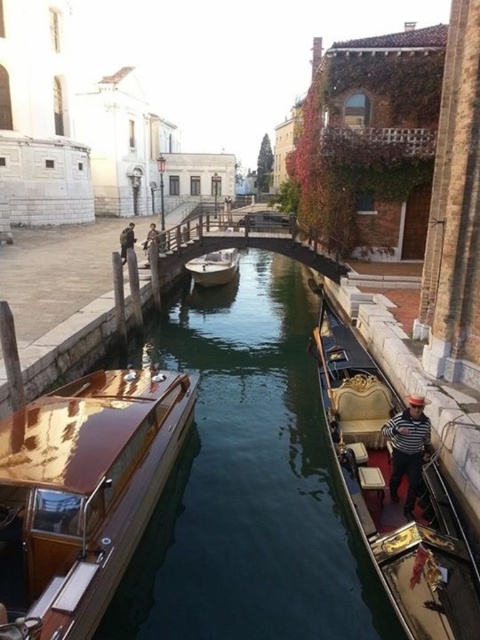
Which is behind, point (107, 484) or point (190, 266)?

The point (190, 266) is more distant.

What do you see at coordinates (84, 490) in the screenshot?
I see `glossy wood boat at center` at bounding box center [84, 490].

Where is `glossy wood boat at center`? This screenshot has width=480, height=640. glossy wood boat at center is located at coordinates (84, 490).

Between glossy wood boat at center and gold polished wood gondola at center, which one is positioned lower?

glossy wood boat at center is lower down.

Between glossy wood boat at center and gold polished wood gondola at center, which one has more height?

Standing taller between the two is gold polished wood gondola at center.

Which is in front, point (80, 454) or point (421, 532)?

Point (80, 454) is in front.

This screenshot has height=640, width=480. What are the coordinates of `glossy wood boat at center` in the screenshot? It's located at [x=84, y=490].

Between gold polished wood gondola at center and wooden polished boat at center, which one has more height?

gold polished wood gondola at center is taller.

Is gold polished wood gondola at center further to the viewer compared to wooden polished boat at center?

No, it is not.

Who is more distant from viewer, (384, 378) or (214, 252)?

Point (214, 252)

Find the location of `gold polished wood gondola at center`. gold polished wood gondola at center is located at coordinates click(388, 493).